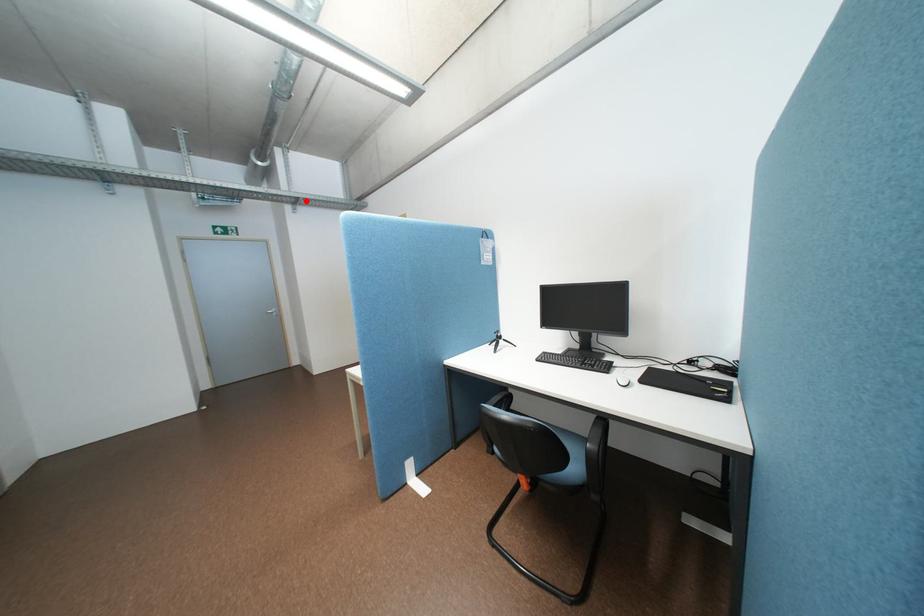
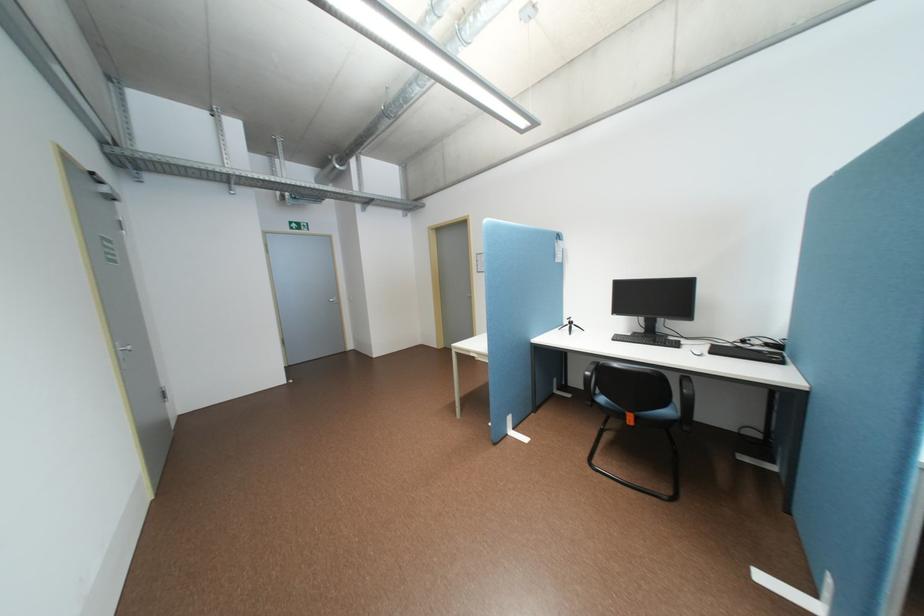
Find the pixel in the second image that matches the highlighted location in the first image.

(379, 201)